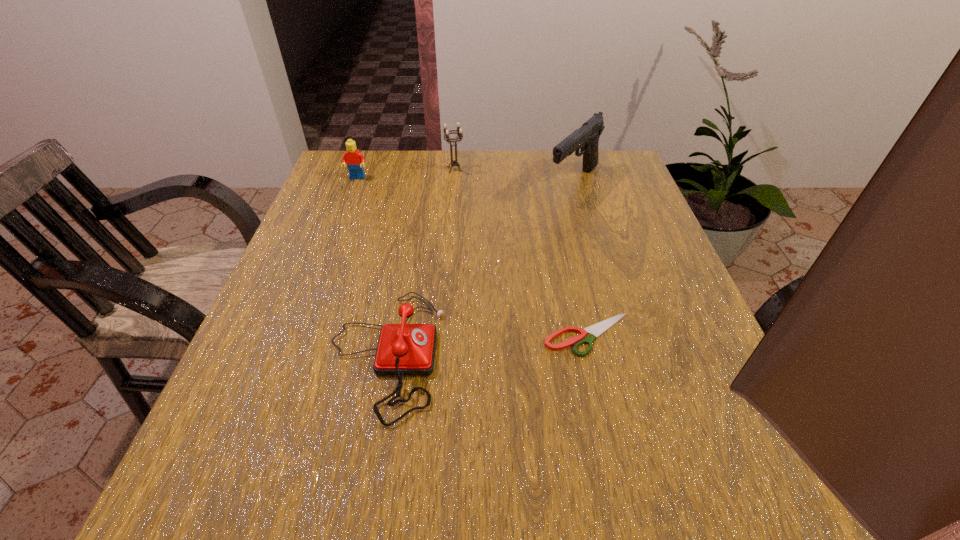
Find the location of `vacant area between the Lego and the gun`. vacant area between the Lego and the gun is located at coordinates (466, 180).

You are a GUI agent. You are given a task and a screenshot of the screen. Output one action in this format:
    pyautogui.click(x=<x>, y=<y>)
    Task: Click on the vacant point located between the telephone and the scissors
    The image size is (960, 540).
    Given the screenshot: What is the action you would take?
    pyautogui.click(x=487, y=344)

Image resolution: width=960 pixels, height=540 pixels. I want to click on free space that is in between the shortest object and the gun, so click(x=581, y=259).

You are a GUI agent. You are given a task and a screenshot of the screen. Output one action in this format:
    pyautogui.click(x=<x>, y=<y>)
    Task: Click on the unoccupied position between the tallest object and the fourth tallest object
    This screenshot has width=960, height=540.
    Given the screenshot: What is the action you would take?
    pyautogui.click(x=479, y=268)

Image resolution: width=960 pixels, height=540 pixels. Find the location of `the fourth closest object relative to the scissors`. the fourth closest object relative to the scissors is located at coordinates (354, 159).

Identify which object is located as the third nearest to the scissors. Please provide its 2D coordinates. Your answer should be formatted as a tuple, i.e. [(x, y)], where the tuple contains the x and y coordinates of a point satisfying the conditions above.

[(459, 130)]

Locate an element on the screen. The height and width of the screenshot is (540, 960). free location that satisfies the following two spatial constraints: 1. on the face of the scissors; 2. on the left side of the third tallest object is located at coordinates (299, 335).

Locate an element on the screen. The width and height of the screenshot is (960, 540). free spot that satisfies the following two spatial constraints: 1. on the front side of the candle holder; 2. on the dial of the fourth tallest object is located at coordinates (440, 354).